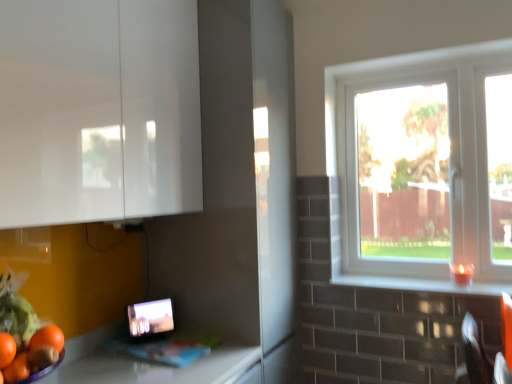
What are the coordinates of `free space in front of matte black tablet at lower left` in the screenshot? It's located at (153, 347).